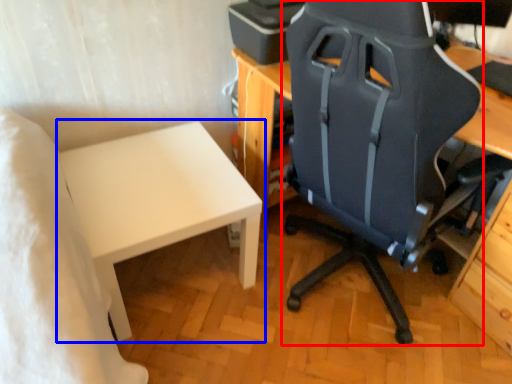
Question: Among these objects, which one is nearest to the camera, chair (highlighted by a red box) or table (highlighted by a blue box)?

Choices:
 (A) chair
 (B) table

Answer: (A)